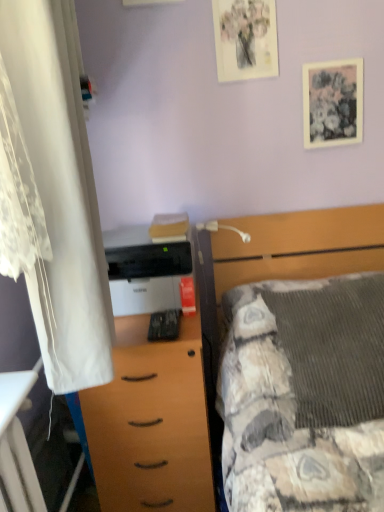
Question: Which is correct: white plastic lamp at upper center is inside textured gray blanket at center, or outside of it?

Choices:
 (A) inside
 (B) outside

Answer: (B)

Question: From their relative heights in the image, would you say white plastic lamp at upper center is taller or shorter than textured gray blanket at center?

Choices:
 (A) tall
 (B) short

Answer: (B)

Question: Estimate the real-world distances between objects in this image. Which object is closer to the white lace curtain at left?

Choices:
 (A) matte paper picture frame at upper right, the first picture frame from the right
 (B) white plastic lamp at upper center
 (C) wooden desk at lower left
 (D) wooden chest of drawers at center
 (E) white matte printer at center

Answer: (C)

Question: Estimate the real-world distances between objects in this image. Which object is farther from the matte paper picture frame at upper right, which ranks as the 1th picture frame in bottom-to-top order?

Choices:
 (A) white plastic lamp at upper center
 (B) textured gray blanket at center
 (C) white lace curtain at left
 (D) wooden desk at lower left
 (E) white matte printer at center

Answer: (D)